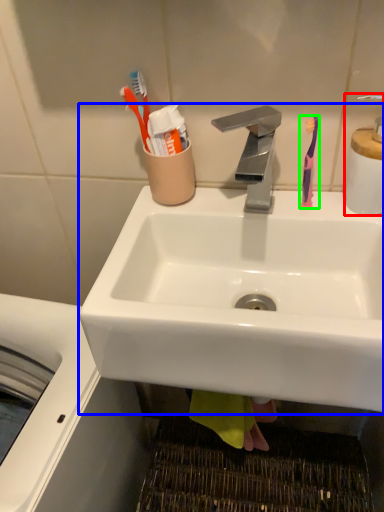
Question: Based on their relative distances, which object is nearer to soap dispenser (highlighted by a red box)? Choose from sink (highlighted by a blue box) and toothbrush (highlighted by a green box).

Choices:
 (A) sink
 (B) toothbrush

Answer: (B)